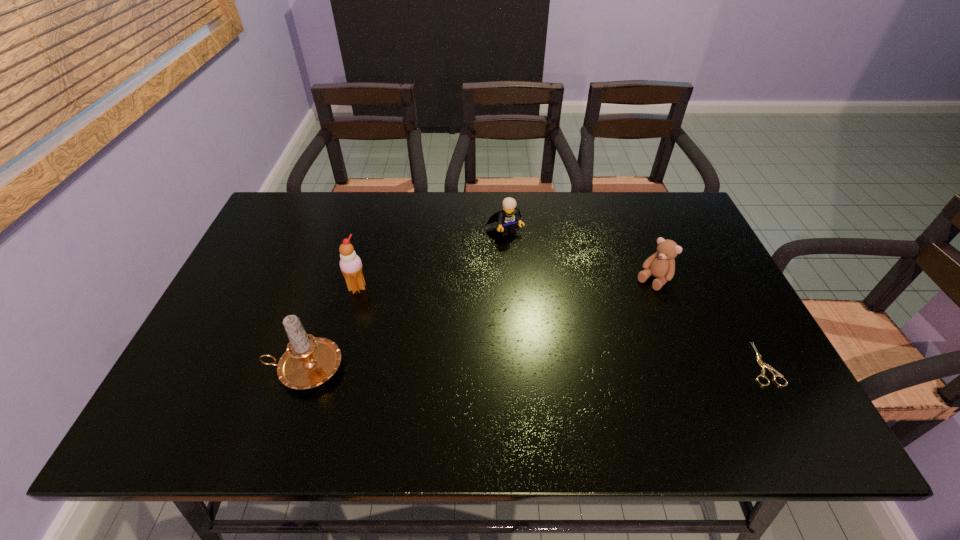
This screenshot has height=540, width=960. Find the location of `free space on the desktop that is between the candle and the shortest object and is positioned at the front with a straw on the icecream`. free space on the desktop that is between the candle and the shortest object and is positioned at the front with a straw on the icecream is located at coordinates (476, 366).

At what (x,y) coordinates should I click in order to perform the action: click on vacant space on the desktop that is between the candle and the rightmost object and is positioned on the front-facing side of the teddy bear. Please return your answer as a coordinate pair (x, y). The image size is (960, 540). Looking at the image, I should click on (572, 366).

In order to click on vacant spot on the desktop that is between the candle and the rightmost object and is positioned on the front-facing side of the farthest object in this screenshot , I will do `click(588, 366)`.